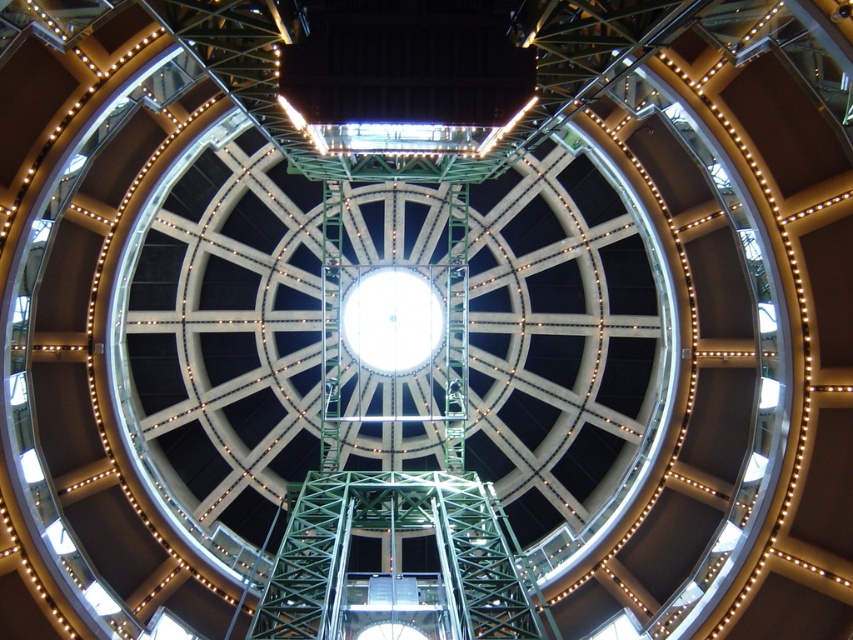
You are an architect visiting the atrium and need to determine if the green metallic structure at center can be seen over the white glass clock at center from the entrance. Based on their heights, what is your conclusion?

The green metallic structure at center is taller than the white glass clock at center, so yes, the green metallic structure at center can be seen over the white glass clock at center from the entrance.

You are an architect designing a new exhibit and need to place a sculpture that requires a minimum of 10 meters of space between two key points. You have access to the green metallic structure at center and the white glass clock at center. Can you use these two points as the endpoints for your sculpture?

The distance between the green metallic structure at center and the white glass clock at center is 9.78 meters, which is less than the required 10 meters. Therefore, these two points cannot be used as endpoints for the sculpture requiring 10 meters of space.

You are standing in the atrium and want to locate the green metallic structure at center. According to the coordinates provided, where should you look relative to the central dome?

The green metallic structure at center is located at coordinates point (393, 468), which means it is positioned slightly to the right and above the central dome.